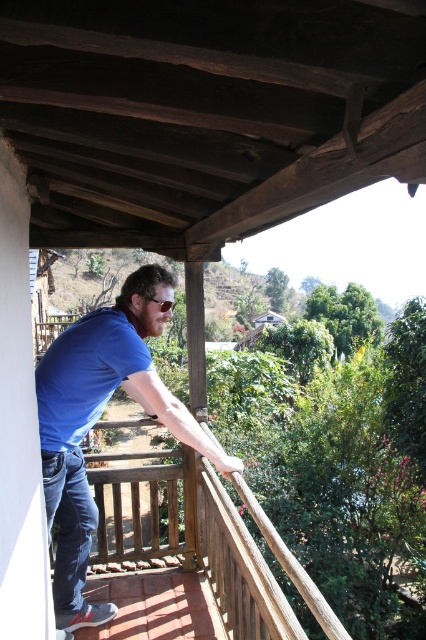
Is point (146, 381) closer to viewer compared to point (221, 502)?

Yes, point (146, 381) is closer to viewer.

Can you confirm if blue cotton shirt at center is positioned above wooden railing at upper center?

Correct, blue cotton shirt at center is located above wooden railing at upper center.

Locate an element on the screen. blue cotton shirt at center is located at coordinates (97, 417).

You are a GUI agent. You are given a task and a screenshot of the screen. Output one action in this format:
    pyautogui.click(x=<x>, y=<y>)
    Task: Click on the blue cotton shirt at center
    This screenshot has height=640, width=426.
    Given the screenshot: What is the action you would take?
    pyautogui.click(x=97, y=417)

Does blue cotton shirt at center lie behind blue denim jeans at lower left?

No.

What do you see at coordinates (97, 417) in the screenshot?
I see `blue cotton shirt at center` at bounding box center [97, 417].

Which is behind, point (51, 401) or point (58, 548)?

The point (58, 548) is more distant.

At what (x,y) coordinates should I click in order to perform the action: click on blue cotton shirt at center. Please return your answer as a coordinate pair (x, y). Looking at the image, I should click on (97, 417).

Does wooden railing at upper center have a greater height compared to blue denim jeans at lower left?

Yes.

Is wooden railing at upper center smaller than blue denim jeans at lower left?

No, wooden railing at upper center is not smaller than blue denim jeans at lower left.

Who is more distant from viewer, (279, 620) or (86, 548)?

The point (86, 548) is more distant.

Find the location of `wooden railing at upper center`. wooden railing at upper center is located at coordinates click(199, 545).